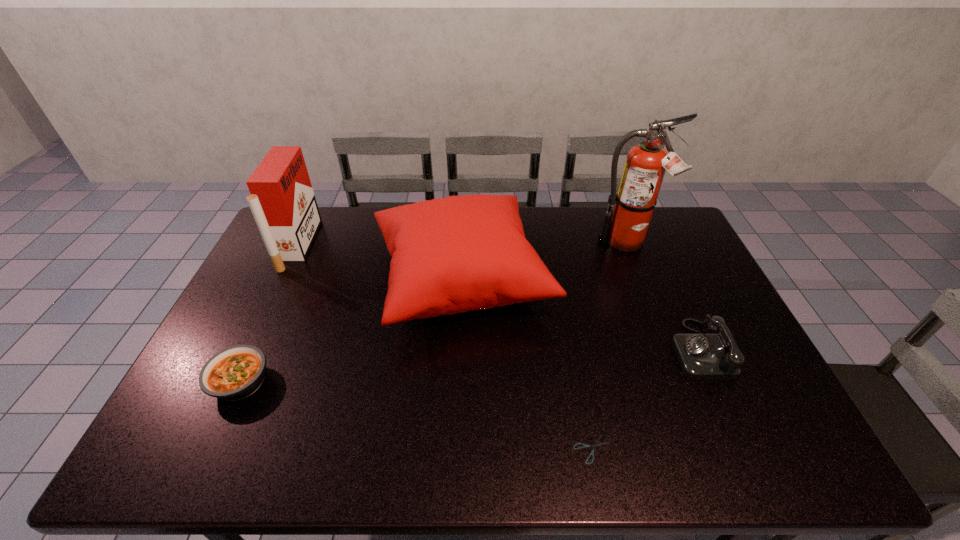
I want to click on the tallest object, so click(625, 228).

Where is `cigarette case`? This screenshot has width=960, height=540. cigarette case is located at coordinates (282, 201).

Identify the location of the fourth shortest object. (450, 255).

This screenshot has height=540, width=960. I want to click on the fourth tallest object, so [702, 356].

Find the location of `stew`. stew is located at coordinates (234, 373).

Identify the location of shears. (596, 444).

At what (x,y) coordinates should I click in order to perform the action: click on the shortest object. Please return your answer as a coordinate pair (x, y). This screenshot has height=540, width=960. Looking at the image, I should click on (596, 444).

The height and width of the screenshot is (540, 960). In order to click on vacant space located 0.170m from the nozzle of the fire extinguisher in this screenshot , I will do `click(646, 295)`.

Locate an element on the screen. The height and width of the screenshot is (540, 960). free region located on the front-facing side of the second tallest object is located at coordinates (406, 245).

You are a GUI agent. You are given a task and a screenshot of the screen. Output one action in this format:
    pyautogui.click(x=<x>, y=<y>)
    Task: Click on the free region located 0.160m on the front of the third tallest object
    Image resolution: width=960 pixels, height=540 pixels.
    Given the screenshot: What is the action you would take?
    pyautogui.click(x=456, y=403)